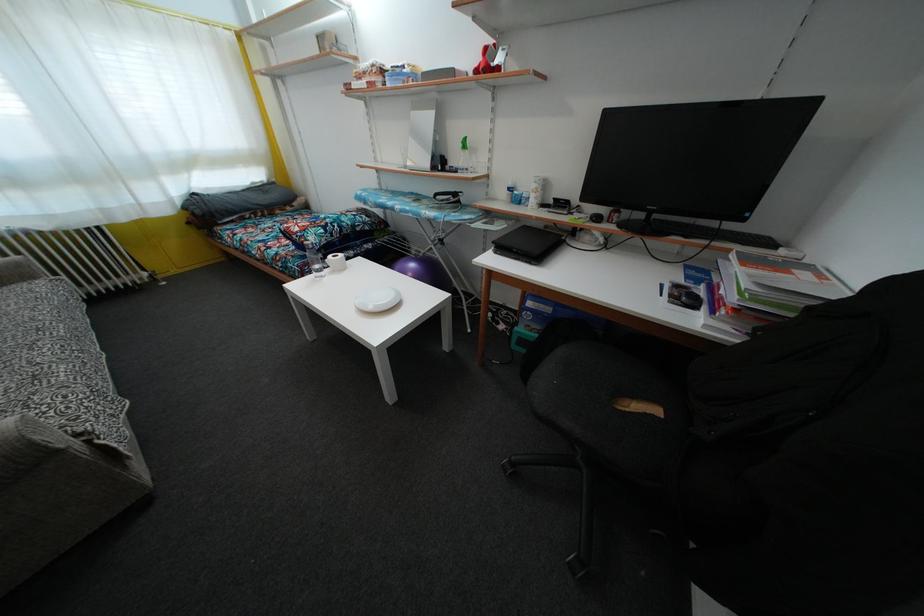
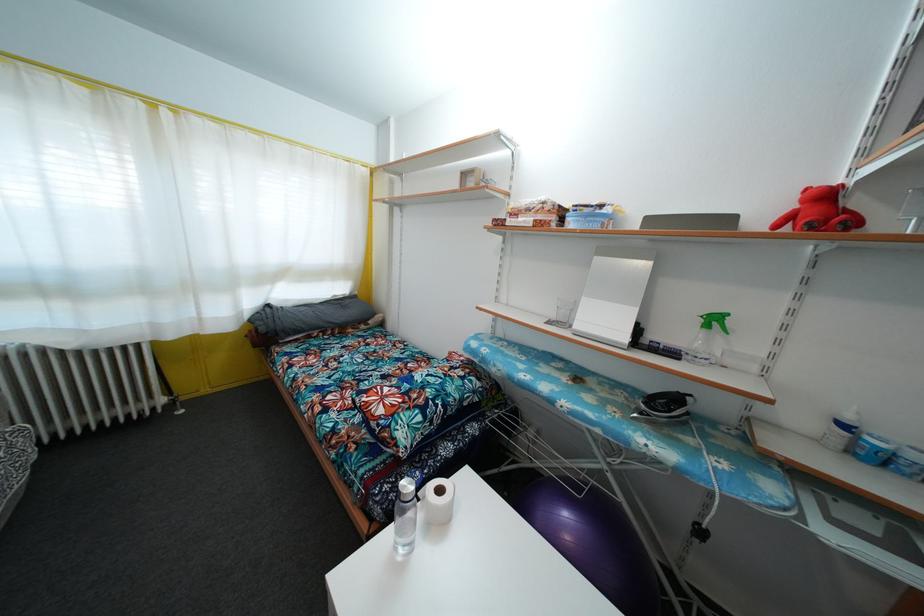
Where in the second image is the point corresponding to (x=369, y=79) from the first image?

(531, 216)